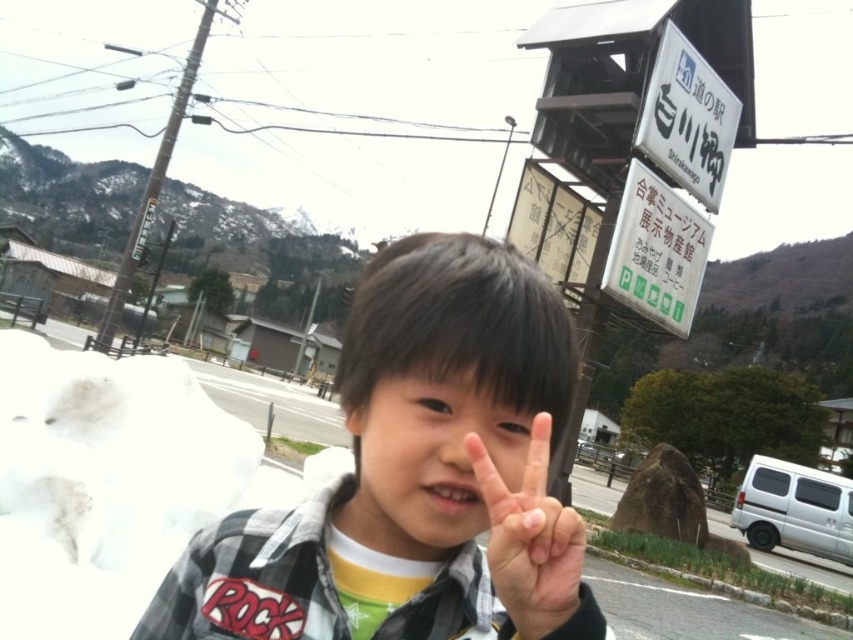
You are taking a photo of the scene and want to focus on both the point at coordinate (x=538, y=428) and the point at coordinate (x=672, y=312). Which point should you adjust your focus to first to ensure both are in clear view?

You should focus on the point at coordinate (x=672, y=312) first because it is farther from the camera than the point at coordinate (x=538, y=428). By focusing on the farther point, both points will be in focus if the depth of field is sufficient.

You are a tourist in Japan and see the plaid shirt at center and the white plastic sign at upper center in the image. Which object is closer to the top of the image?

The white plastic sign at upper center is closer to the top of the image because the plaid shirt at center is positioned under it.

You are a photographer trying to capture the child and the sign in the background. Since the smooth skin hand at center and the white plastic sign at upper right are both in the frame, which object would appear larger in your photo?

The smooth skin hand at center would appear larger in the photo because it is closer to the viewer than the white plastic sign at upper right.